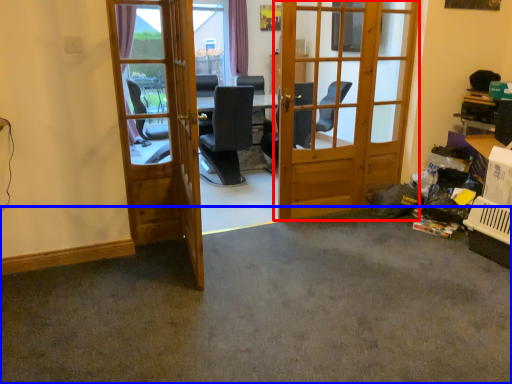
Question: Which object is closer to the camera taking this photo, door (highlighted by a red box) or concrete (highlighted by a blue box)?

Choices:
 (A) door
 (B) concrete

Answer: (B)